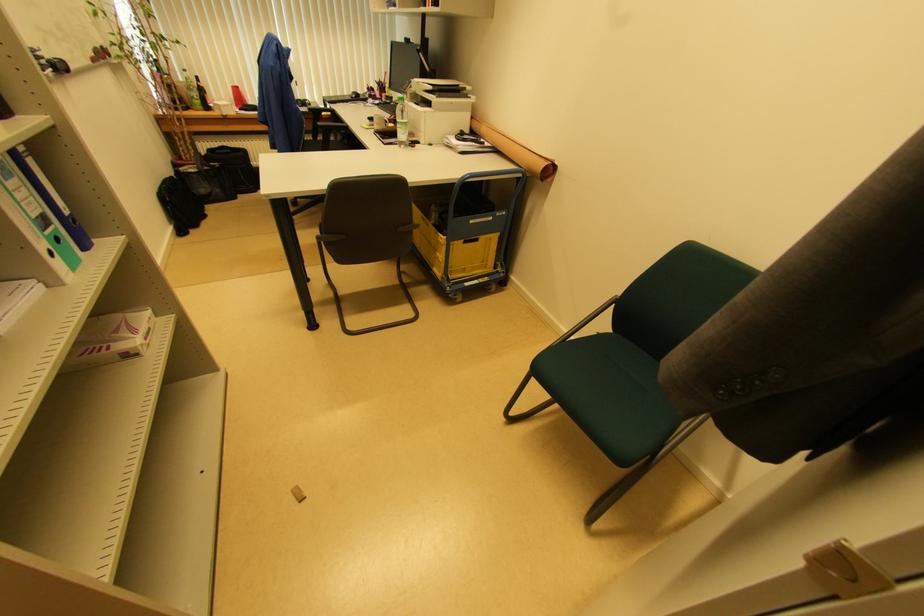
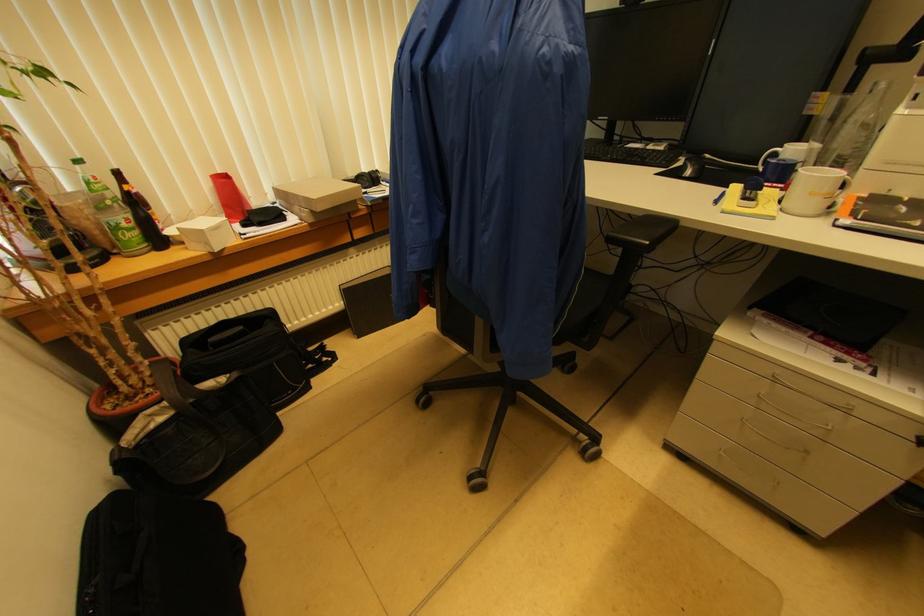
The point at (223, 113) is marked in the first image. Where is the corresponding point in the second image?

(209, 246)